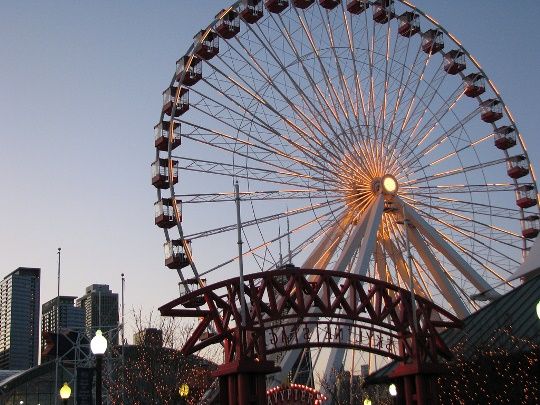
This screenshot has height=405, width=540. I want to click on white colored light, so click(99, 343), click(395, 392).